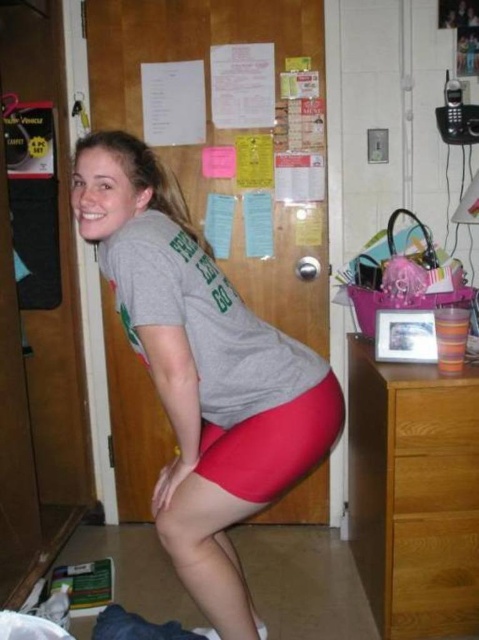
Question: Is matte red shorts at center above brown wooden dresser at right?

Choices:
 (A) no
 (B) yes

Answer: (B)

Question: Is matte red shorts at center smaller than brown wooden dresser at right?

Choices:
 (A) yes
 (B) no

Answer: (B)

Question: Which point is farther to the camera?

Choices:
 (A) (447, 572)
 (B) (452, 449)

Answer: (A)

Question: Which of the following is the farthest from the observer?

Choices:
 (A) matte red shorts at center
 (B) wooden drawer at lower right
 (C) brown wooden dresser at right

Answer: (B)

Question: Does matte red shorts at center appear over wooden drawer at lower right?

Choices:
 (A) no
 (B) yes

Answer: (B)

Question: Which point is closer to the camera taking this photo?

Choices:
 (A) (442, 445)
 (B) (139, 164)
 (C) (455, 435)

Answer: (B)